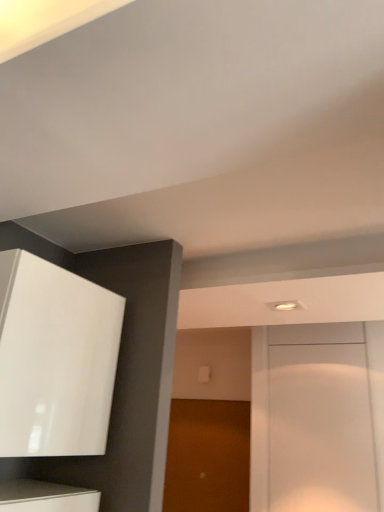
Question: Which direction should I rotate to look at brown matte door at center, the second door positioned from the right, — up or down?

Choices:
 (A) up
 (B) down

Answer: (B)

Question: Is glossy white cabinet at upper left at the left side of white glossy door at center, which ranks as the second door in back-to-front order?

Choices:
 (A) yes
 (B) no

Answer: (A)

Question: Is glossy white cabinet at upper left oriented away from white glossy door at center, which ranks as the second door in back-to-front order?

Choices:
 (A) yes
 (B) no

Answer: (B)

Question: Does glossy white cabinet at upper left have a larger size compared to white glossy door at center, which ranks as the second door in back-to-front order?

Choices:
 (A) yes
 (B) no

Answer: (A)

Question: From a real-world perspective, is glossy white cabinet at upper left positioned over white glossy door at center, the 2th door from the left, based on gravity?

Choices:
 (A) no
 (B) yes

Answer: (B)

Question: Is glossy white cabinet at upper left closer to the viewer compared to white glossy door at center, which ranks as the second door in back-to-front order?

Choices:
 (A) no
 (B) yes

Answer: (B)

Question: Is glossy white cabinet at upper left at the right side of white glossy door at center, placed as the first door when sorted from front to back?

Choices:
 (A) no
 (B) yes

Answer: (A)

Question: Could you tell me if glossy white cabinet at upper left is facing brown matte door at center, the 1th door when ordered from back to front?

Choices:
 (A) no
 (B) yes

Answer: (A)

Question: Considering the relative positions of glossy white cabinet at upper left and brown matte door at center, the second door viewed from the front, in the image provided, is glossy white cabinet at upper left to the right of brown matte door at center, the second door viewed from the front, from the viewer's perspective?

Choices:
 (A) no
 (B) yes

Answer: (A)

Question: Is brown matte door at center, the 1th door when ordered from back to front, a part of glossy white cabinet at upper left?

Choices:
 (A) no
 (B) yes

Answer: (A)

Question: From a real-world perspective, does glossy white cabinet at upper left stand above brown matte door at center, the second door viewed from the front?

Choices:
 (A) yes
 (B) no

Answer: (A)

Question: Does glossy white cabinet at upper left have a lesser width compared to brown matte door at center, which is counted as the 1th door, starting from the left?

Choices:
 (A) yes
 (B) no

Answer: (B)

Question: Is glossy white cabinet at upper left closer to camera compared to brown matte door at center, the second door positioned from the right?

Choices:
 (A) no
 (B) yes

Answer: (B)

Question: From the image's perspective, would you say brown matte door at center, which is counted as the 1th door, starting from the left, is shown under white glossy door at center, which ranks as the first door in right-to-left order?

Choices:
 (A) no
 (B) yes

Answer: (B)